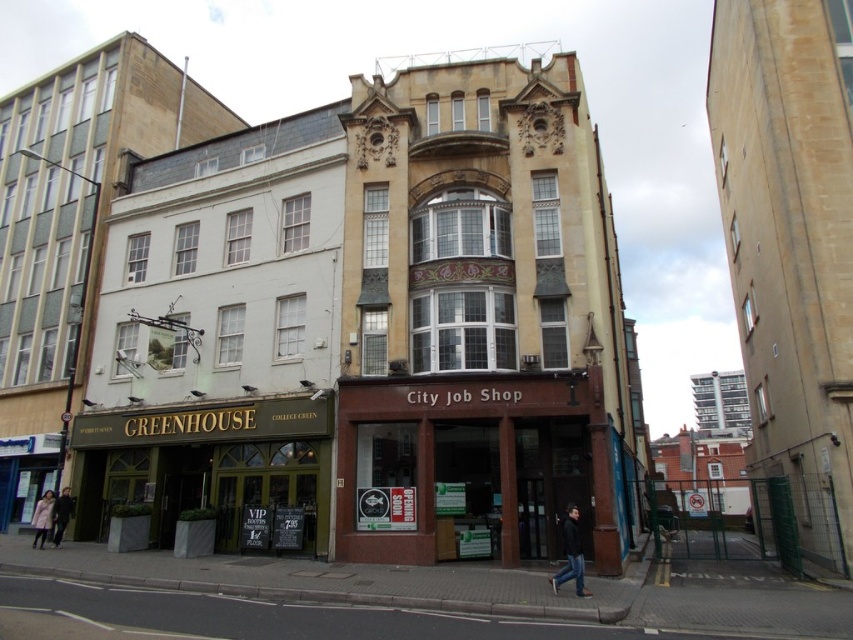
Question: Is brown wooden city job shop at center wider than dark blue jacket at lower right?

Choices:
 (A) no
 (B) yes

Answer: (B)

Question: Which point is farther from the camera taking this photo?

Choices:
 (A) (572, 513)
 (B) (469, 460)

Answer: (B)

Question: Is brown wooden city job shop at center to the right of dark blue jacket at lower right from the viewer's perspective?

Choices:
 (A) yes
 (B) no

Answer: (B)

Question: Can you confirm if brown wooden city job shop at center is positioned below dark blue jacket at lower right?

Choices:
 (A) no
 (B) yes

Answer: (A)

Question: Among these objects, which one is nearest to the camera?

Choices:
 (A) brown wooden city job shop at center
 (B) dark blue jacket at lower right

Answer: (B)